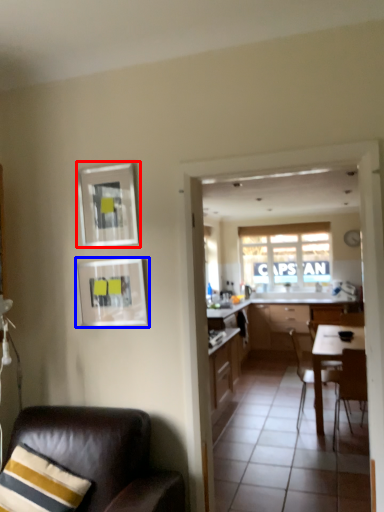
Question: Which object is closer to the camera taking this photo, picture frame (highlighted by a red box) or picture frame (highlighted by a blue box)?

Choices:
 (A) picture frame
 (B) picture frame

Answer: (B)